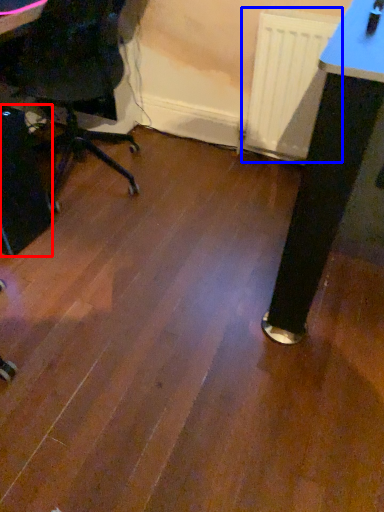
Question: Which object appears closest to the camera in this image, computer tower (highlighted by a red box) or radiator (highlighted by a blue box)?

Choices:
 (A) computer tower
 (B) radiator

Answer: (A)